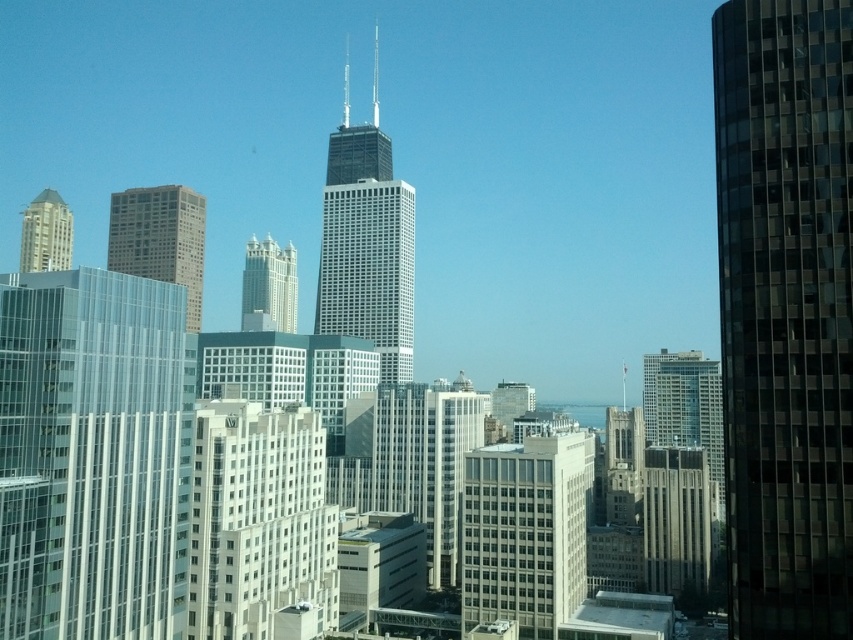
You are a drone operator who needs to fly a drone between the matte glass skyscraper at center and the matte gold building at upper left. The drone has a maximum flight distance of 300 feet. Can the drone safely make this flight without exceeding its range?

The matte glass skyscraper at center and matte gold building at upper left are 299.01 feet apart from each other. Since the drone has a maximum flight distance of 300 feet, it can safely fly between them without exceeding its range.

You are a city planner analyzing the skyline. You notice the matte glass skyscraper at center and the matte gold building at upper left. Which of these two structures is closer to the observer in this view?

The matte glass skyscraper at center is closer to the observer because it is positioned in front of the matte gold building at upper left.

You are standing in the city and want to determine the relative positions of two points in the skyline. Which point, point [833,476] or point [352,172], is closer to you?

Point [833,476] is closer to the viewer than point [352,172].